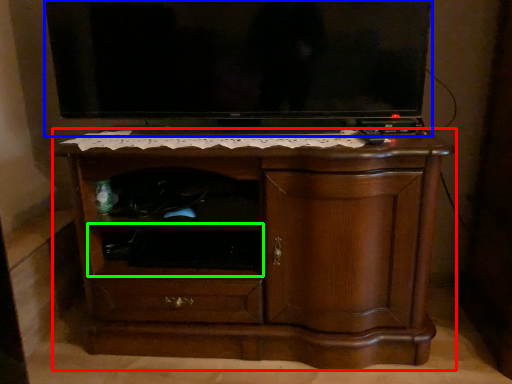
Question: Estimate the real-world distances between objects in this image. Which object is farther from chest of drawers (highlighted by a red box), television (highlighted by a blue box) or shelf (highlighted by a green box)?

Choices:
 (A) television
 (B) shelf

Answer: (A)